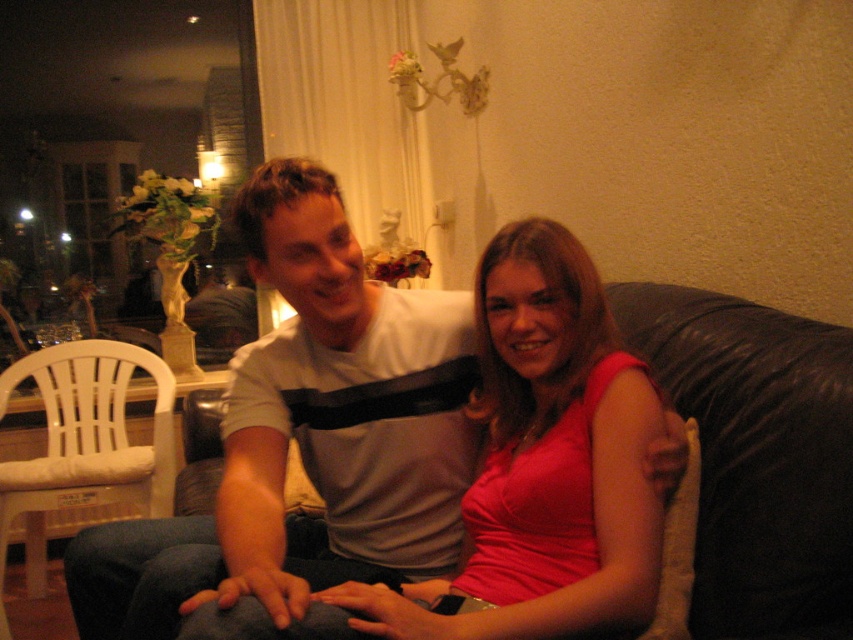
You are standing in the living room and want to sit down. You see the black leather couch at center and the white plastic chair at left. Which one is closer to you?

The black leather couch at center is closer to you than the white plastic chair at left.

You are sitting on the white plastic chair at left and want to move to the black leather couch at center. Is the couch above or below your current position?

The black leather couch at center is above the white plastic chair at left, so the couch is higher in position than your current seat.